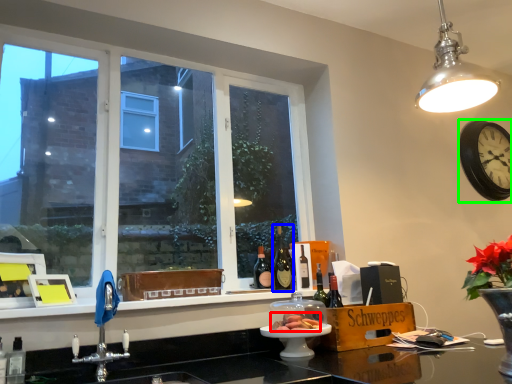
Question: Estimate the real-world distances between objects in this image. Which object is closer to food (highlighted by a red box), bottle (highlighted by a blue box) or clock (highlighted by a green box)?

Choices:
 (A) bottle
 (B) clock

Answer: (A)